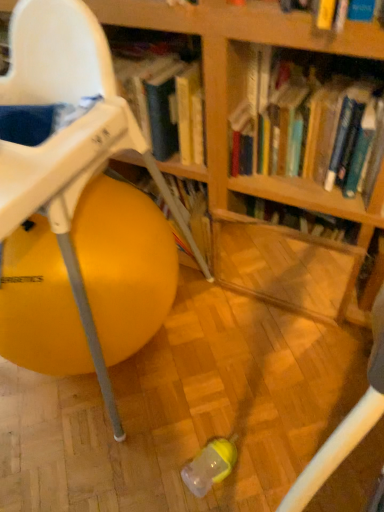
Question: Considering their positions, is yellow rubber ball at left located in front of or behind hardcover book at upper center?

Choices:
 (A) behind
 (B) front

Answer: (B)

Question: Is point (26, 26) closer or farther from the camera than point (331, 155)?

Choices:
 (A) farther
 (B) closer

Answer: (B)

Question: Considering the relative positions of yellow rubber ball at left and hardcover book at upper center in the image provided, is yellow rubber ball at left to the left or to the right of hardcover book at upper center?

Choices:
 (A) right
 (B) left

Answer: (B)

Question: From a real-world perspective, is hardcover book at upper center positioned above or below yellow rubber ball at left?

Choices:
 (A) below
 (B) above

Answer: (B)

Question: Which is correct: hardcover book at upper center is inside yellow rubber ball at left, or outside of it?

Choices:
 (A) outside
 (B) inside

Answer: (A)

Question: Is hardcover book at upper center to the left or to the right of yellow rubber ball at left in the image?

Choices:
 (A) left
 (B) right

Answer: (B)

Question: Considering the positions of point (352, 163) and point (74, 96), is point (352, 163) closer or farther from the camera than point (74, 96)?

Choices:
 (A) closer
 (B) farther

Answer: (B)